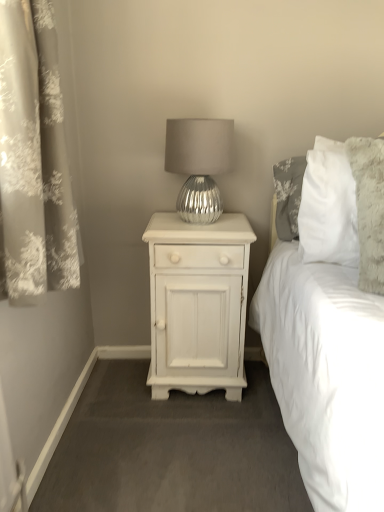
This screenshot has width=384, height=512. What do you see at coordinates (199, 164) in the screenshot?
I see `silver metallic lamp at center` at bounding box center [199, 164].

Where is `white painted wood nightstand at center`? white painted wood nightstand at center is located at coordinates (198, 304).

Image resolution: width=384 pixels, height=512 pixels. Find the location of `silver metallic lamp at center`. silver metallic lamp at center is located at coordinates (199, 164).

From their relative heights in the image, would you say silver metallic lamp at center is taller or shorter than white painted wood nightstand at center?

In the image, silver metallic lamp at center appears to be shorter than white painted wood nightstand at center.

Who is bigger, silver metallic lamp at center or white painted wood nightstand at center?

white painted wood nightstand at center.

From a real-world perspective, who is located lower, silver metallic lamp at center or silvery floral curtain at left?

silver metallic lamp at center, from a real-world perspective.

Considering the sizes of objects silver metallic lamp at center and silvery floral curtain at left in the image provided, who is thinner, silver metallic lamp at center or silvery floral curtain at left?

silvery floral curtain at left is thinner.

Based on the photo, from the image's perspective, which one is positioned higher, silver metallic lamp at center or silvery floral curtain at left?

silver metallic lamp at center.

Does silver metallic lamp at center have a lesser height compared to silvery floral curtain at left?

Yes.

Is silvery floral curtain at left inside or outside of white painted wood nightstand at center?

The correct answer is: outside.

Is silvery floral curtain at left directly adjacent to white painted wood nightstand at center?

No, silvery floral curtain at left is not in contact with white painted wood nightstand at center.

Is silvery floral curtain at left facing away from white painted wood nightstand at center?

silvery floral curtain at left does not have its back to white painted wood nightstand at center.

From a real-world perspective, which object rests below the other?

From a 3D spatial view, silver metallic lamp at center is below.

Can silver metallic lamp at center be found inside silvery floral curtain at left?

That's incorrect, silver metallic lamp at center is not inside silvery floral curtain at left.

Identify the location of lamp that appears below the silvery floral curtain at left (from a real-world perspective). This screenshot has width=384, height=512. (199, 164).

Which of these two, silvery floral curtain at left or silver metallic lamp at center, is wider?

With larger width is silver metallic lamp at center.

Which of these two, white painted wood nightstand at center or silver metallic lamp at center, is bigger?

With larger size is white painted wood nightstand at center.

Which object is positioned more to the right, white painted wood nightstand at center or silver metallic lamp at center?

silver metallic lamp at center.

Which object is wider, white painted wood nightstand at center or silver metallic lamp at center?

white painted wood nightstand at center is wider.

Would you say white painted wood nightstand at center is outside silvery floral curtain at left?

white painted wood nightstand at center is positioned outside silvery floral curtain at left.

In terms of size, does white painted wood nightstand at center appear bigger or smaller than silvery floral curtain at left?

white painted wood nightstand at center is bigger than silvery floral curtain at left.

From the image's perspective, relative to silvery floral curtain at left, is white painted wood nightstand at center above or below?

Clearly, from the image's perspective, white painted wood nightstand at center is below silvery floral curtain at left.

Is white painted wood nightstand at center closer to the viewer compared to silvery floral curtain at left?

That is False.

You are a GUI agent. You are given a task and a screenshot of the screen. Output one action in this format:
    pyautogui.click(x=<x>, y=<y>)
    Task: Click on the nightstand located on the left of silver metallic lamp at center
    This screenshot has height=512, width=384.
    Given the screenshot: What is the action you would take?
    pyautogui.click(x=198, y=304)

I want to click on lamp above the silvery floral curtain at left (from the image's perspective), so click(x=199, y=164).

Consider the image. Considering their positions, is silvery floral curtain at left positioned closer to white painted wood nightstand at center than silver metallic lamp at center?

Based on the image, silver metallic lamp at center appears to be nearer to white painted wood nightstand at center.

Which object lies nearer to the anchor point silver metallic lamp at center, white painted wood nightstand at center or silvery floral curtain at left?

white painted wood nightstand at center lies closer to silver metallic lamp at center than the other object.

Which object lies further to the anchor point silvery floral curtain at left, white painted wood nightstand at center or silver metallic lamp at center?

white painted wood nightstand at center lies further to silvery floral curtain at left than the other object.

Based on their spatial positions, is silver metallic lamp at center or silvery floral curtain at left closer to white painted wood nightstand at center?

Among the two, silver metallic lamp at center is located nearer to white painted wood nightstand at center.

Considering their positions, is silver metallic lamp at center positioned further to silvery floral curtain at left than white painted wood nightstand at center?

white painted wood nightstand at center is further to silvery floral curtain at left.

When comparing their distances from silver metallic lamp at center, does silvery floral curtain at left or white painted wood nightstand at center seem closer?

white painted wood nightstand at center.

The height and width of the screenshot is (512, 384). I want to click on lamp located between silvery floral curtain at left and white painted wood nightstand at center in the depth direction, so click(x=199, y=164).